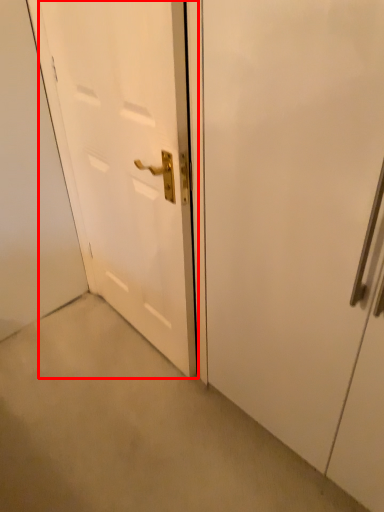
Question: From the image's perspective, where is door (annotated by the red box) located in relation to door in the image?

Choices:
 (A) above
 (B) below

Answer: (A)